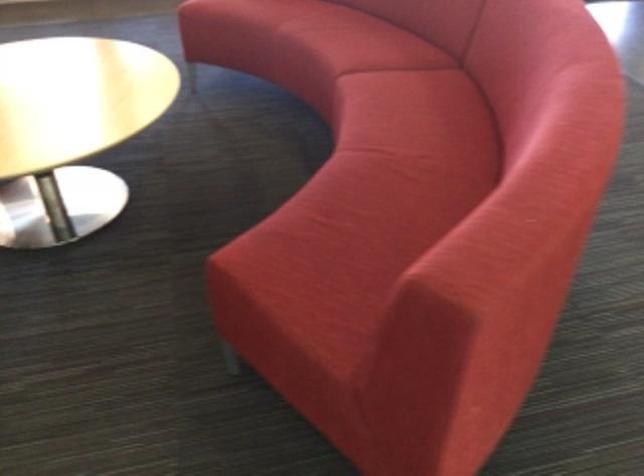
Find where to sit the red sofa sitting surface. Please return your answer as a coordinate pair (x, y).

(422, 135)